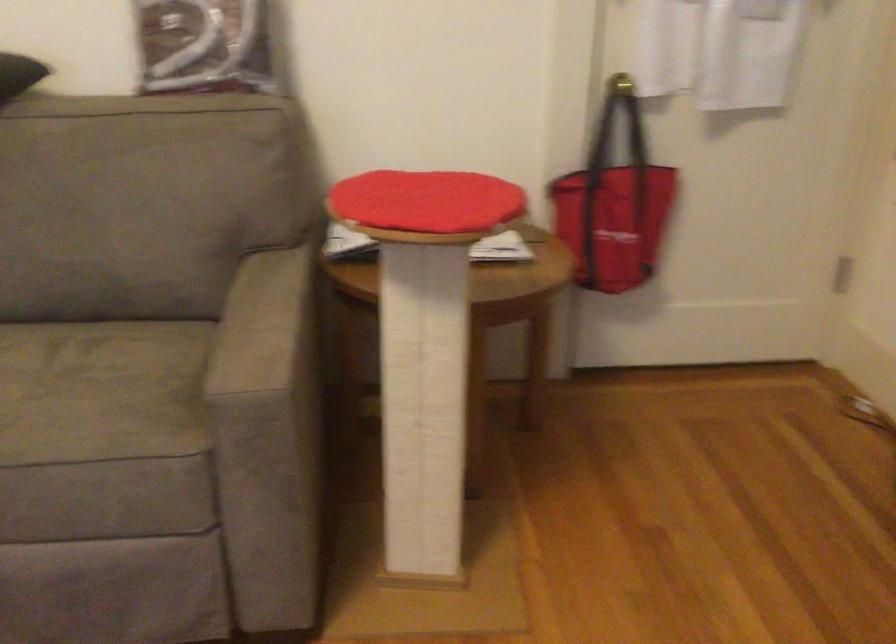
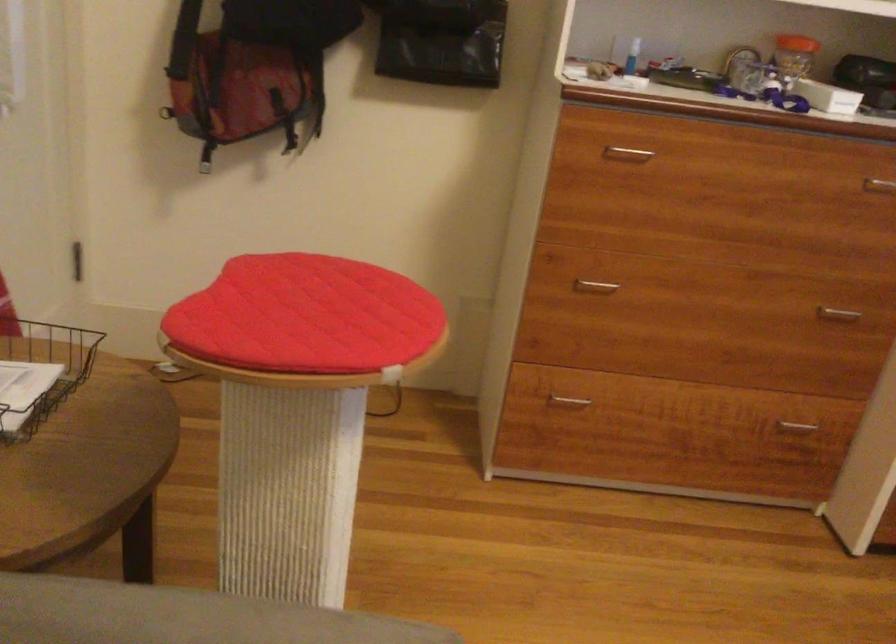
The point at (435, 207) is marked in the first image. Where is the corresponding point in the second image?

(306, 316)